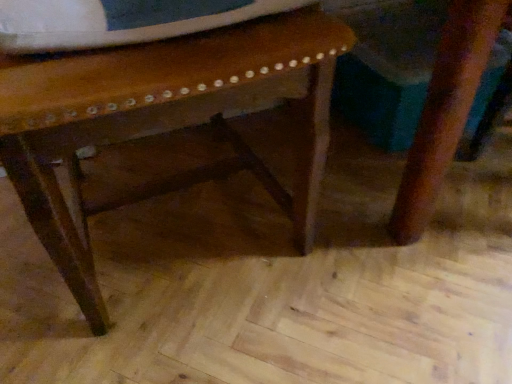
Identify the location of wooden stool at center. The height and width of the screenshot is (384, 512). (163, 123).

The image size is (512, 384). What do you see at coordinates (163, 123) in the screenshot?
I see `wooden stool at center` at bounding box center [163, 123].

The height and width of the screenshot is (384, 512). What are the coordinates of `wooden stool at center` in the screenshot? It's located at pyautogui.click(x=163, y=123).